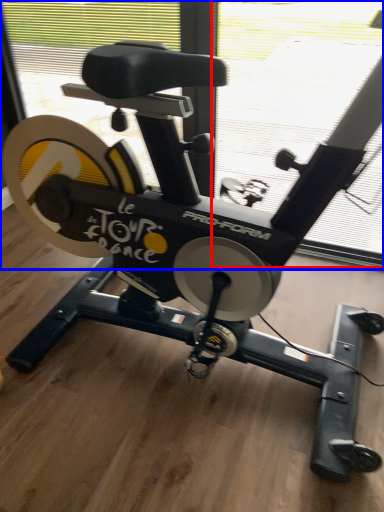
Question: Which of the following is the farthest to the observer, window screen (highlighted by a red box) or window screen (highlighted by a blue box)?

Choices:
 (A) window screen
 (B) window screen

Answer: (A)